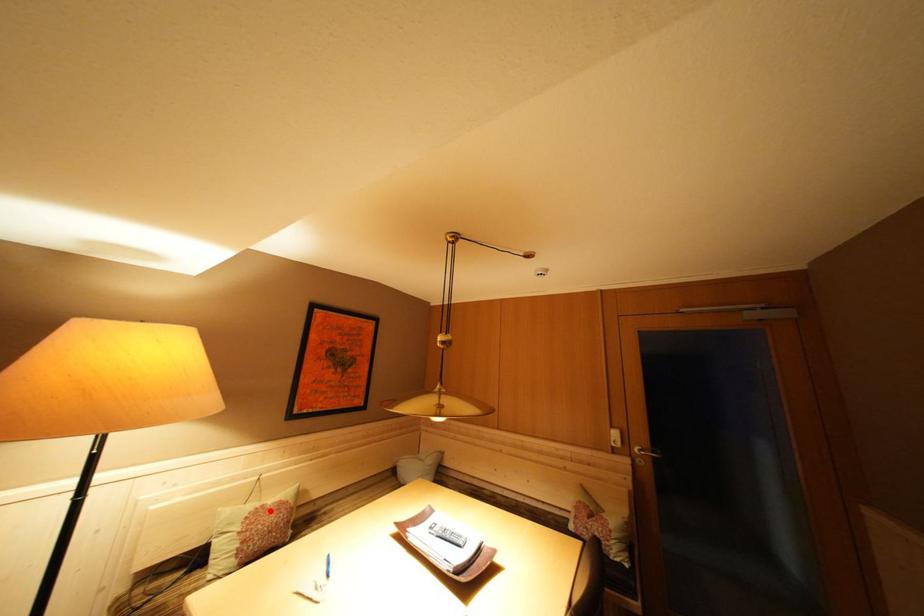
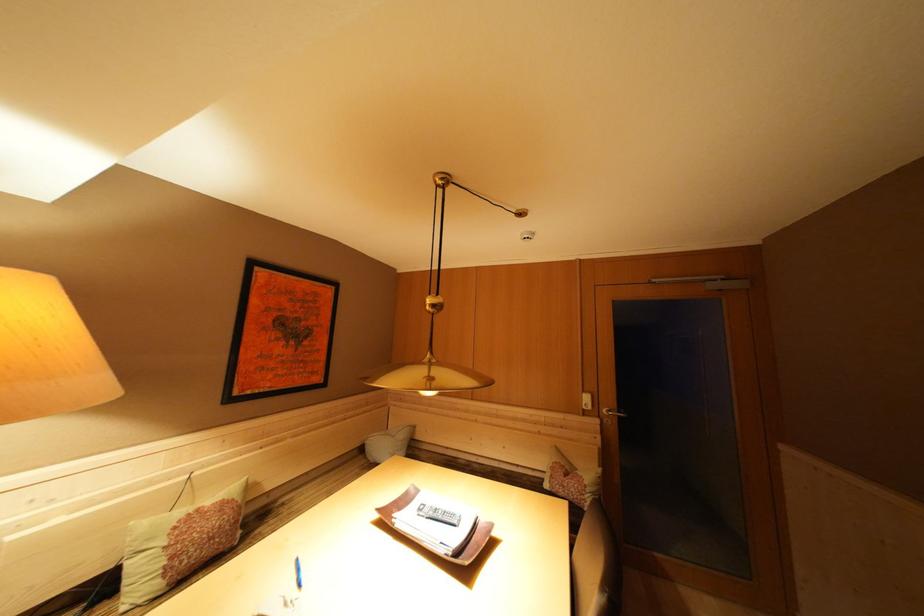
In the second image, find the point that corresponds to the highlighted location in the first image.

(204, 515)